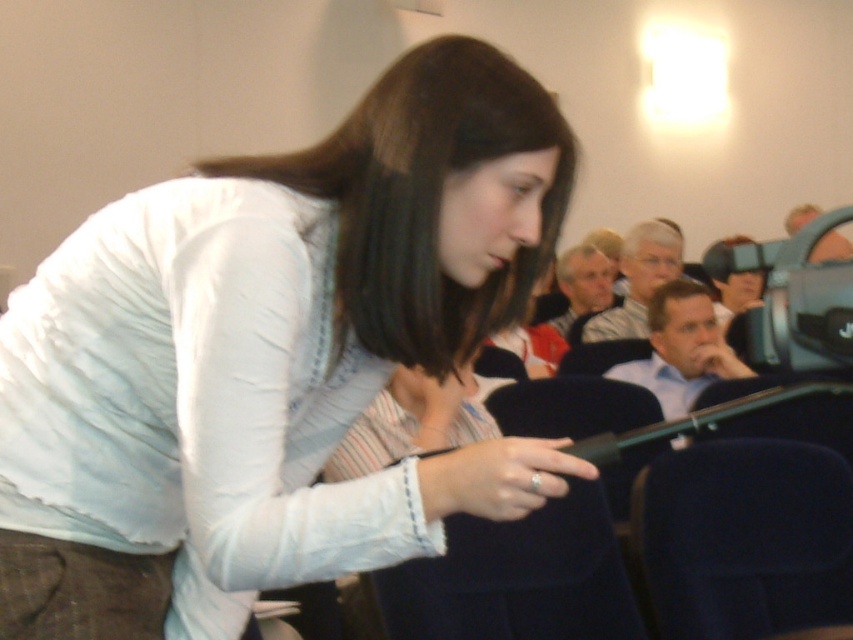
You are a photographer in the conference room and want to capture a shot of the white matte shirt at center and the black plastic video camera at upper right in the same frame. Can you position yourself so that both are visible without moving either object?

The white matte shirt at center is to the left of the black plastic video camera at upper right, so yes, positioning yourself to the left of the shirt and facing towards the camera would allow both to be in the same frame.

In the scene shown: You are a photographer adjusting your camera settings to capture a clear image of the white matte shirt at center. Given that the shirt is 34.65 inches from the camera, what is the minimum distance you should set your camera lens to ensure the shirt is in focus?

The minimum distance you should set your camera lens is 34.65 inches to ensure the white matte shirt at center is in focus.